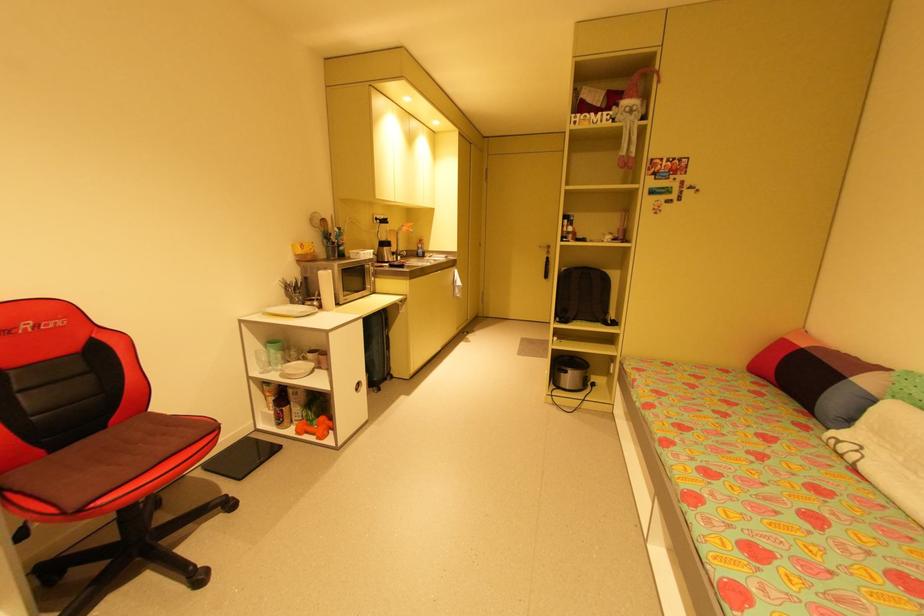
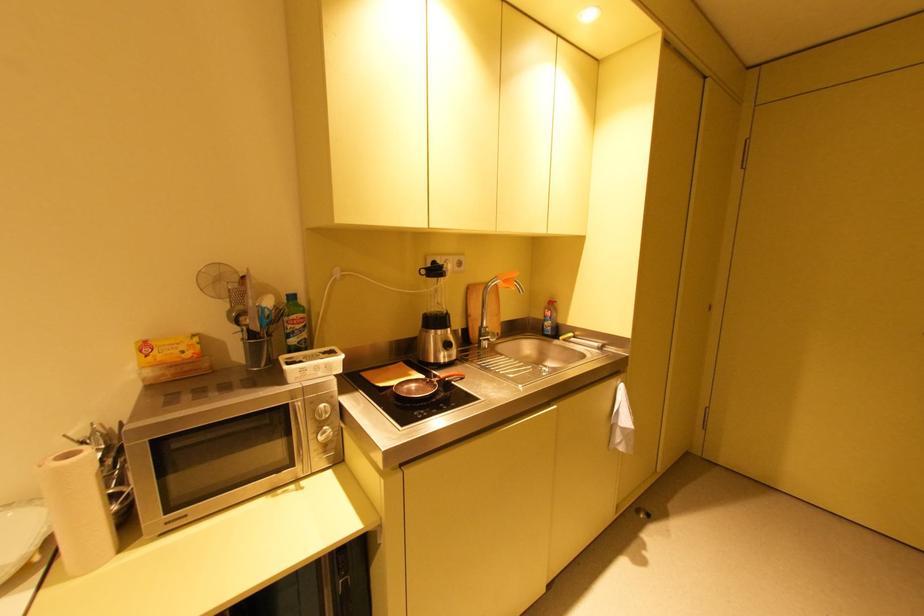
Find the pixel in the second image that matches (391,219) in the first image.

(444, 267)